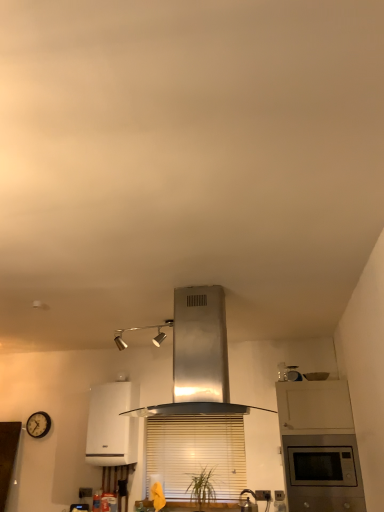
Question: Based on their positions, is satin silver kettle at lower center located to the left or right of wooden blinds at center?

Choices:
 (A) left
 (B) right

Answer: (B)

Question: Is point (248, 501) positioned closer to the camera than point (210, 437)?

Choices:
 (A) closer
 (B) farther

Answer: (A)

Question: Considering the real-world distances, which object is farthest from the satin white cabinet at right?

Choices:
 (A) stainless steel range hood at center, which is counted as the first home appliance, starting from the front
 (B) satin silver microwave at upper right
 (C) wooden clock at lower left
 (D) satin silver kettle at lower center
 (E) wooden blinds at center

Answer: (C)

Question: Estimate the real-world distances between objects in this image. Which object is closer to the satin silver kettle at lower center?

Choices:
 (A) stainless steel range hood at center, the second home appliance in the bottom-to-top sequence
 (B) wooden clock at lower left
 (C) wooden blinds at center
 (D) satin white cabinet at right
 (E) white glossy boiler at center, which ranks as the second home appliance in right-to-left order

Answer: (C)